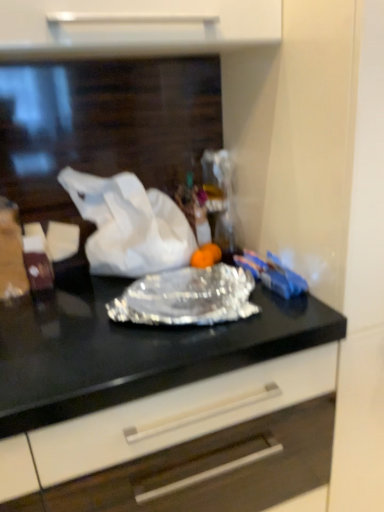
The image size is (384, 512). Identify the location of free spot in front of silver foil wrap at center. (155, 360).